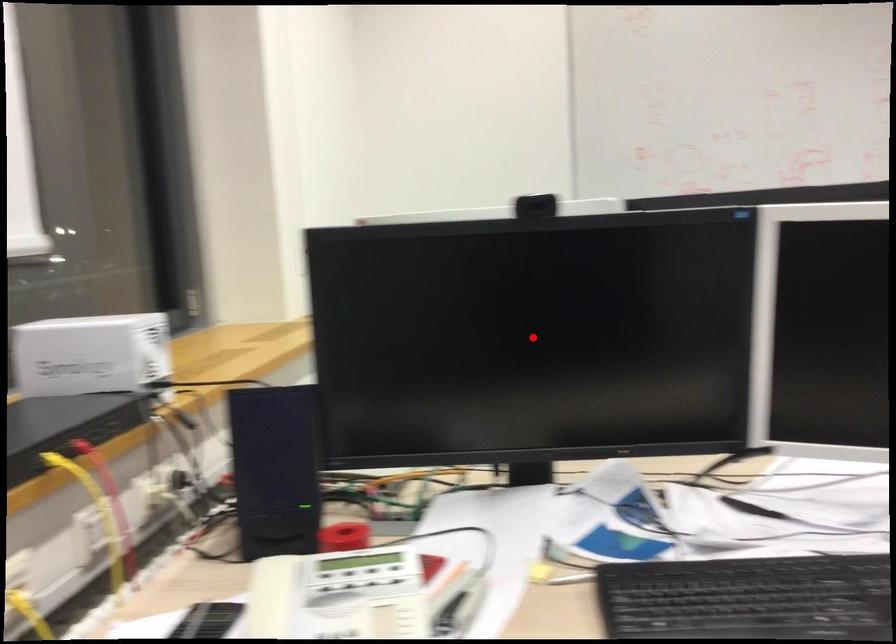
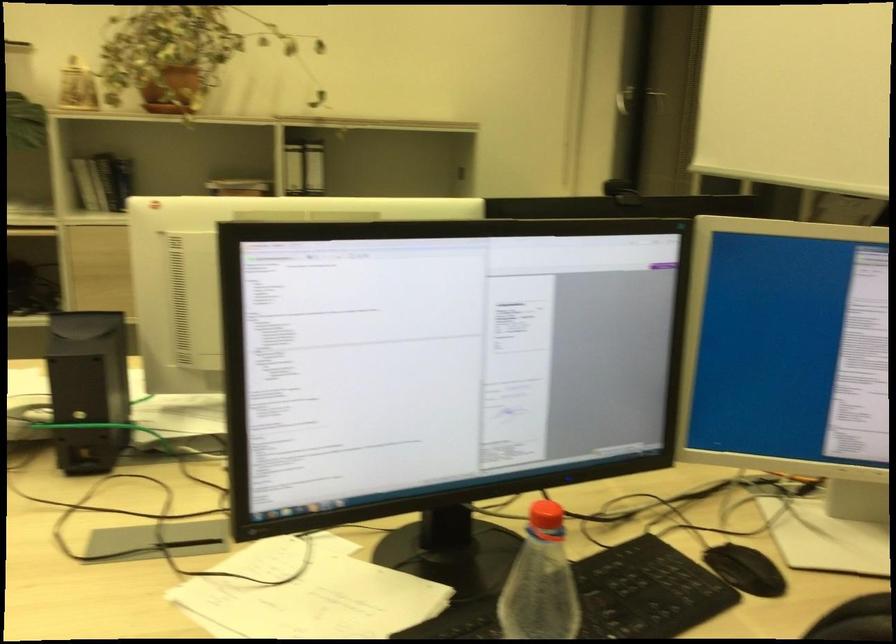
Question: I am providing you with two images of the same scene from different viewpoints. A red point is marked on the first image. Can you still see the location of the red point in image 2?

Choices:
 (A) Yes
 (B) No

Answer: (B)